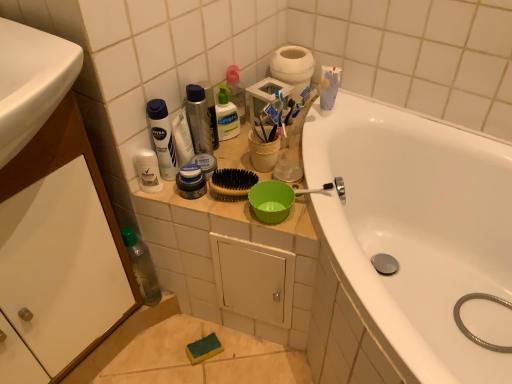
I want to click on free location to the right of metallic silver spray can at upper center, arranged as the third cleaning product when viewed from the right, so click(x=244, y=154).